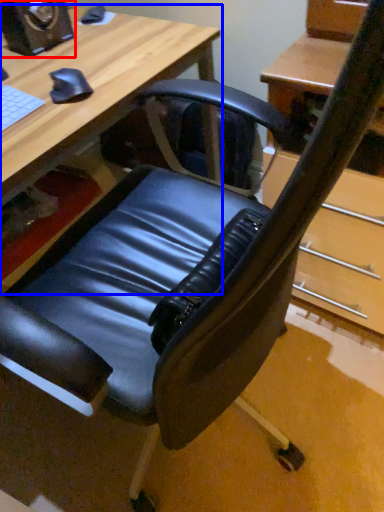
Question: Which point is further to the camera, speaker (highlighted by a red box) or desk (highlighted by a blue box)?

Choices:
 (A) speaker
 (B) desk

Answer: (A)